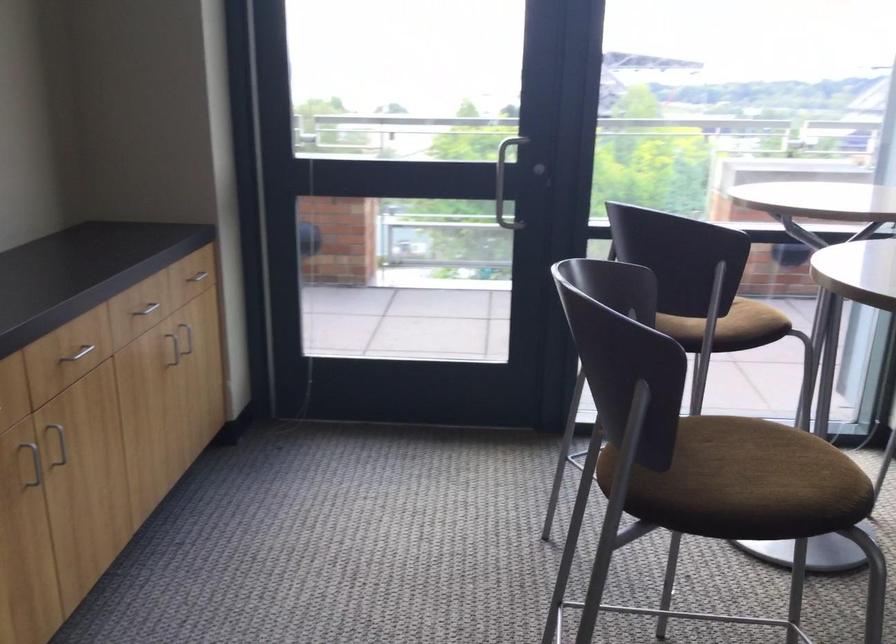
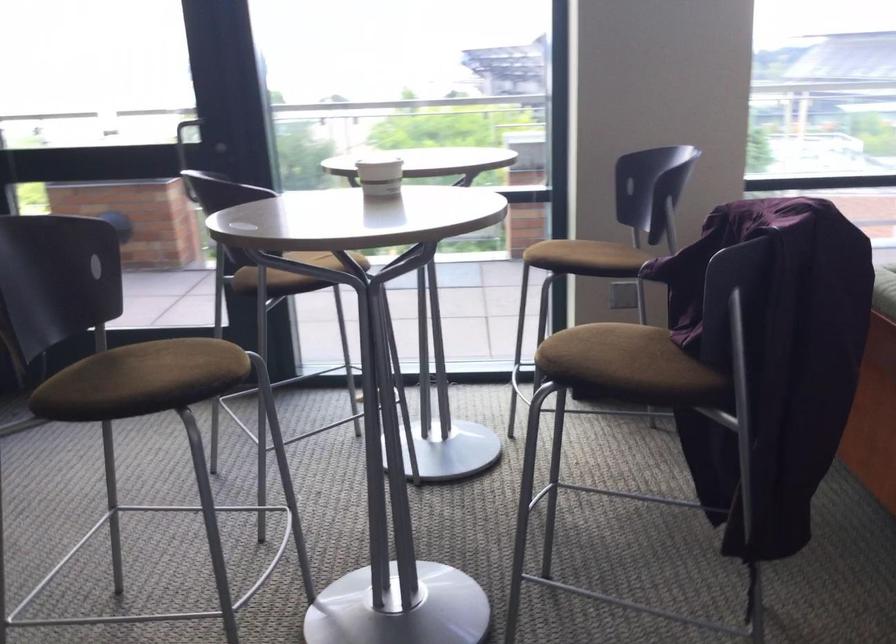
Question: In a continuous first-person perspective shot, in which direction is the camera moving?

Choices:
 (A) Left
 (B) Right
 (C) Forward
 (D) Backward

Answer: (B)